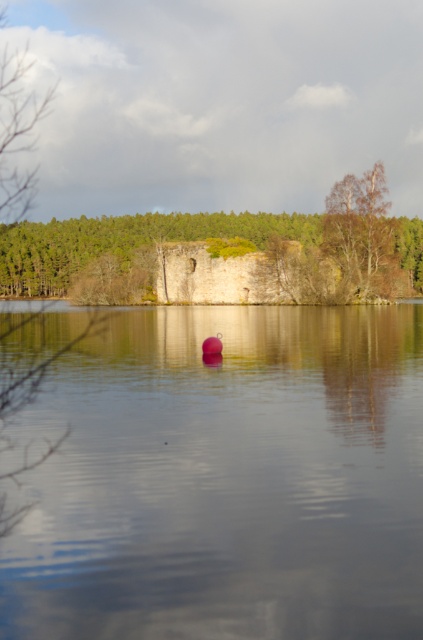
At what (x,y) coordinates should I click in order to perform the action: click on smooth water at center. Please return your answer as a coordinate pair (x, y). The height and width of the screenshot is (640, 423). Looking at the image, I should click on (225, 480).

Which is more to the left, smooth water at center or bare wood tree at right?

From the viewer's perspective, smooth water at center appears more on the left side.

Is point (187, 426) farther from viewer compared to point (364, 192)?

No, it is not.

Identify the location of smooth water at center. (225, 480).